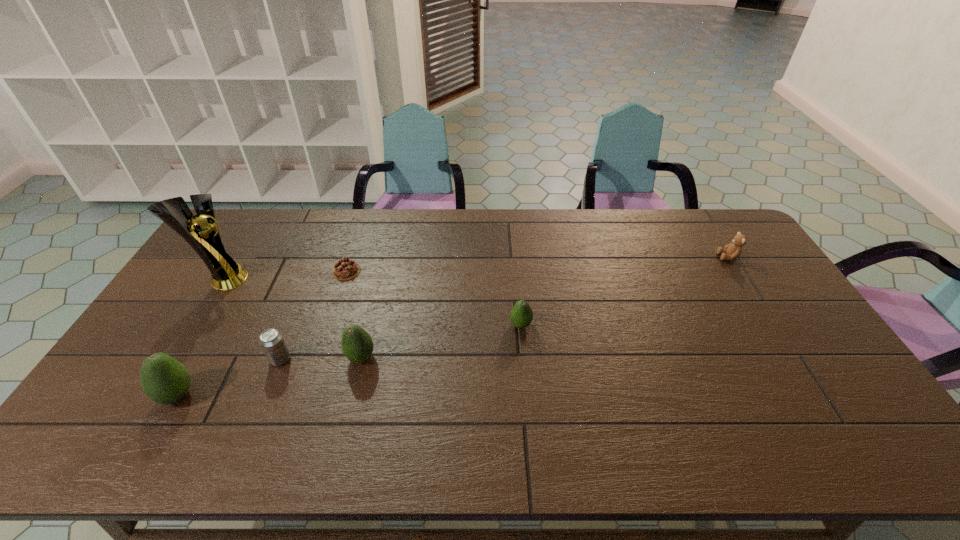
You are a GUI agent. You are given a task and a screenshot of the screen. Output one action in this format:
    pyautogui.click(x=<x>, y=<y>)
    Task: Click on the object present at the near edge
    
    Given the screenshot: What is the action you would take?
    pyautogui.click(x=165, y=380)

Find the location of a particular element. Image resolution: width=960 pixels, height=540 pixels. avocado located at the left edge is located at coordinates (165, 380).

At what (x,y) coordinates should I click in order to perform the action: click on award at the left edge. Please return your answer as a coordinate pair (x, y). Looking at the image, I should click on (226, 274).

I want to click on object that is positioned at the right edge, so click(732, 251).

You are a GUI agent. You are given a task and a screenshot of the screen. Output one action in this format:
    pyautogui.click(x=<x>, y=<y>)
    Task: Click on the object at the near left corner
    
    Given the screenshot: What is the action you would take?
    pyautogui.click(x=165, y=380)

This screenshot has height=540, width=960. What are the coordinates of `vacant region at the far edge` in the screenshot? It's located at (298, 235).

Locate an element on the screen. vacant space at the near edge is located at coordinates (182, 409).

Find the location of a particular element. vacant area at the left edge of the desktop is located at coordinates (197, 265).

In the image, there is a desktop. What are the coordinates of `vacant space at the right edge` in the screenshot? It's located at (815, 355).

The height and width of the screenshot is (540, 960). Identify the location of free space at the near left corner of the desktop. pyautogui.click(x=136, y=398).